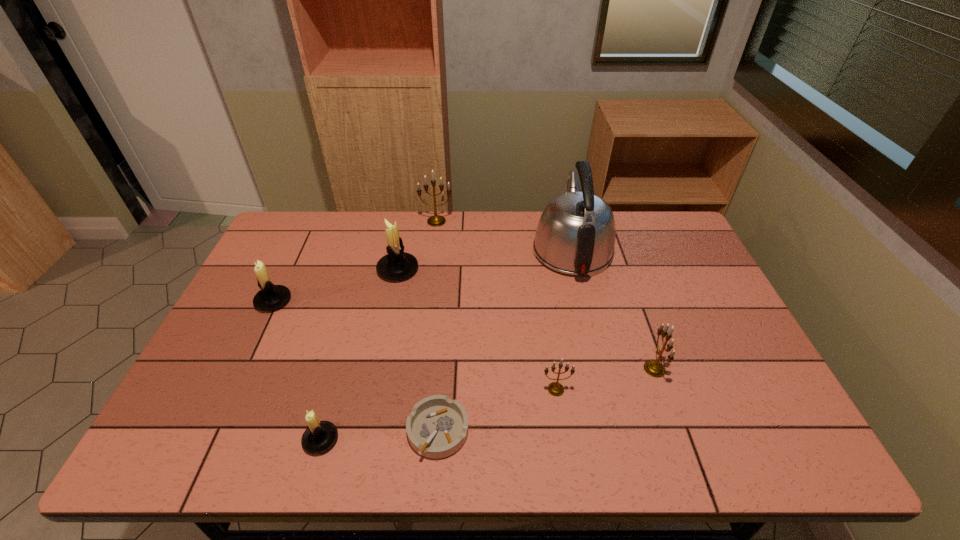
I want to click on empty location between the tallest object and the leftmost gold candelabrum, so click(x=504, y=235).

Identify which object is located as the seventh nearest to the rightmost candle holder. Please provide its 2D coordinates. Your answer should be formatted as a tuple, i.e. [(x, y)], where the tuple contains the x and y coordinates of a point satisfying the conditions above.

[(270, 297)]

Identify which object is located as the nearest to the shortest object. Please provide its 2D coordinates. Your answer should be formatted as a tuple, i.e. [(x, y)], where the tuple contains the x and y coordinates of a point satisfying the conditions above.

[(320, 436)]

Locate an element on the screen. the closest candle holder to the farthest candle holder is located at coordinates (396, 265).

Choose which candle holder is the nearest neighbor to the farthest gold candelabrum. Please provide its 2D coordinates. Your answer should be formatted as a tuple, i.e. [(x, y)], where the tuple contains the x and y coordinates of a point satisfying the conditions above.

[(396, 265)]

Locate which gold candelabrum ranks in proximity to the rightmost candle holder. Please provide its 2D coordinates. Your answer should be formatted as a tuple, i.e. [(x, y)], where the tuple contains the x and y coordinates of a point satisfying the conditions above.

[(556, 389)]

Locate an element on the screen. The image size is (960, 540). gold candelabrum that is the closest to the second gold candelabrum from left to right is located at coordinates coord(654,368).

Where is `white candle holder that is the closest to the biggest white candle holder`? The height and width of the screenshot is (540, 960). white candle holder that is the closest to the biggest white candle holder is located at coordinates (270, 297).

Select which white candle holder is the closest to the ashtray. Please provide its 2D coordinates. Your answer should be formatted as a tuple, i.e. [(x, y)], where the tuple contains the x and y coordinates of a point satisfying the conditions above.

[(320, 436)]

Where is `vacant point that satisfies the following two spatial constraints: 1. on the front side of the nearest white candle holder; 2. on the left side of the fourth nearest candle holder`? This screenshot has width=960, height=540. vacant point that satisfies the following two spatial constraints: 1. on the front side of the nearest white candle holder; 2. on the left side of the fourth nearest candle holder is located at coordinates (207, 440).